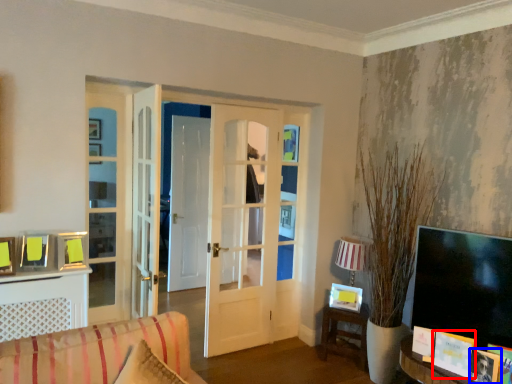
Question: Which of the following is the farthest to the observer, book (highlighted by a red box) or picture frame (highlighted by a blue box)?

Choices:
 (A) book
 (B) picture frame

Answer: (A)